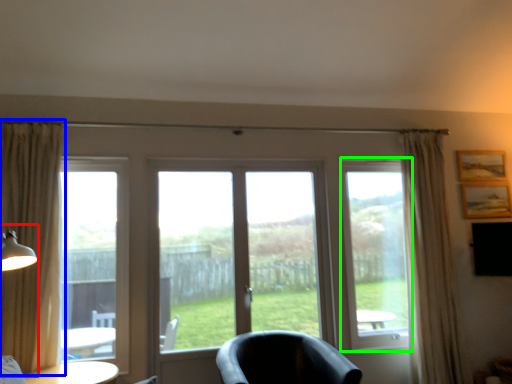
Question: Estimate the real-world distances between objects in this image. Which object is closer to table lamp (highlighted by a red box), curtain (highlighted by a blue box) or window screen (highlighted by a green box)?

Choices:
 (A) curtain
 (B) window screen

Answer: (A)